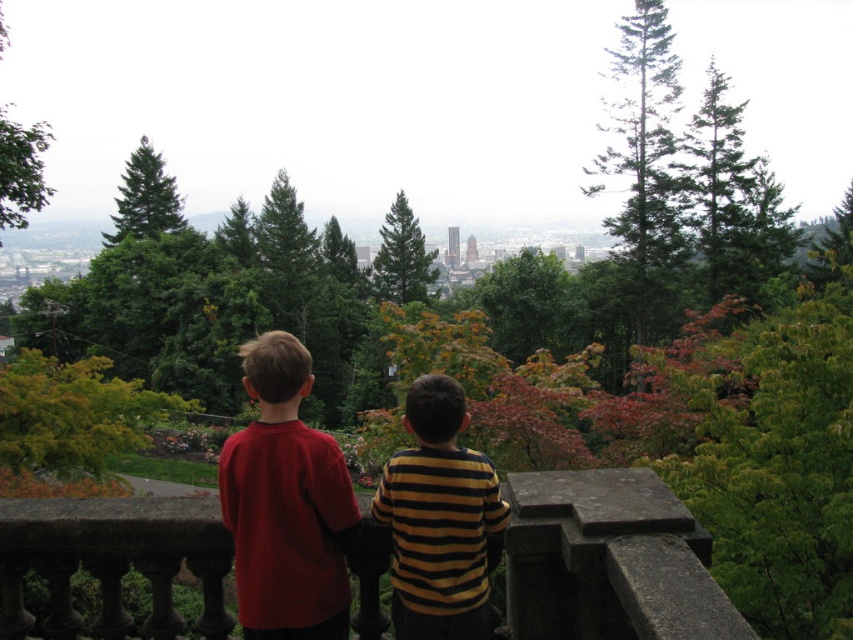
Between striped cotton shirt at center and green matte tree at center, which one has more height?

With more height is green matte tree at center.

Between striped cotton shirt at center and green matte tree at center, which one is positioned higher?

green matte tree at center

Which is behind, point (422, 388) or point (413, 236)?

The point (413, 236) is more distant.

Locate an element on the screen. striped cotton shirt at center is located at coordinates (439, 518).

Is point (148, 212) less distant than point (9, 172)?

No, (148, 212) is behind (9, 172).

Is point (135, 230) positioned behind point (38, 131)?

Yes, point (135, 230) is farther from viewer.

Which is in front, point (143, 227) or point (20, 192)?

Point (20, 192) is more forward.

This screenshot has height=640, width=853. What are the coordinates of `green matte tree at upper left` in the screenshot? It's located at (144, 198).

Which is behind, point (265, 492) or point (393, 252)?

Point (393, 252)

Between point (334, 476) and point (418, 260), which one is positioned in front?

Point (334, 476) is more forward.

Who is more distant from viewer, (323, 552) or (404, 211)?

The point (404, 211) is more distant.

Find the location of a particular element. matte red shirt at center is located at coordinates (285, 502).